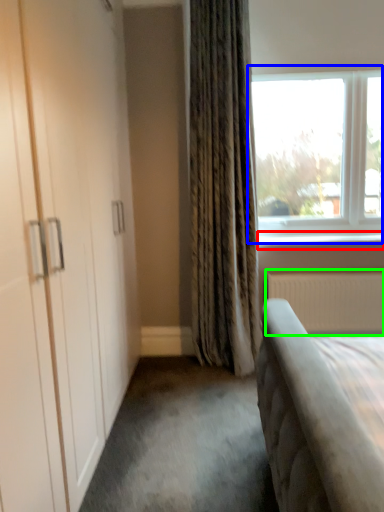
Question: Considering the real-world distances, which object is closest to window sill (highlighted by a red box)? window (highlighted by a blue box) or radiator (highlighted by a green box).

Choices:
 (A) window
 (B) radiator

Answer: (B)